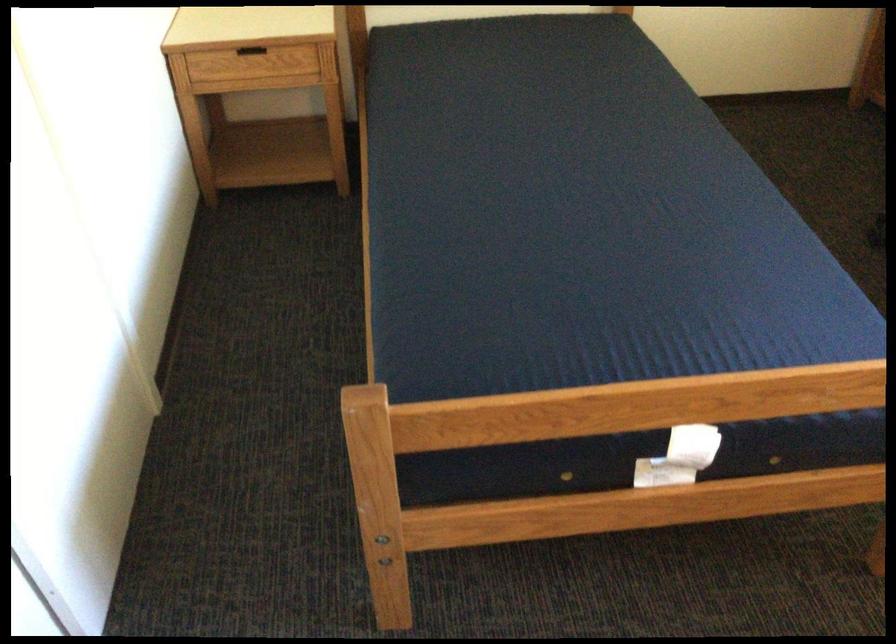
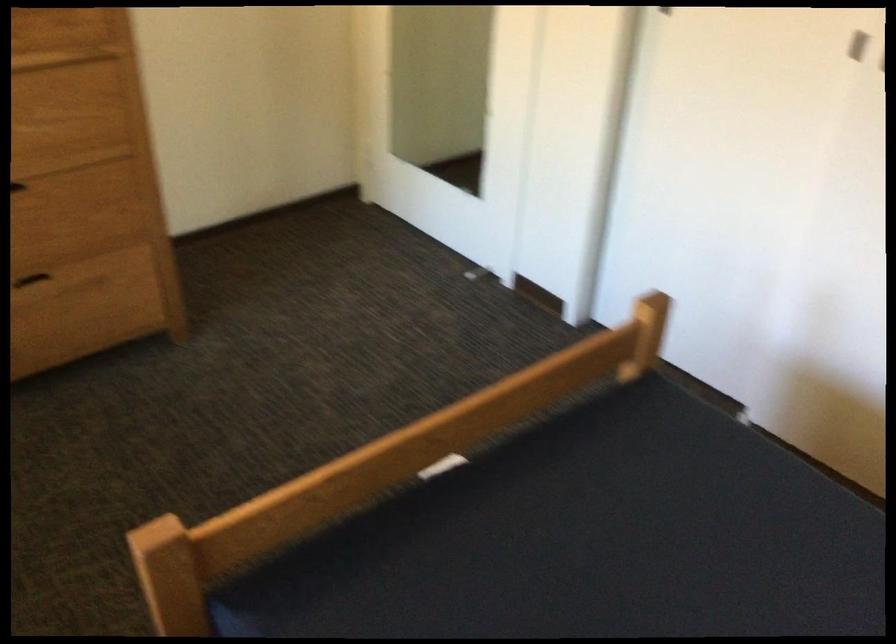
Find the pixel in the second image that matches pixel 733 402 in the first image.

(427, 440)